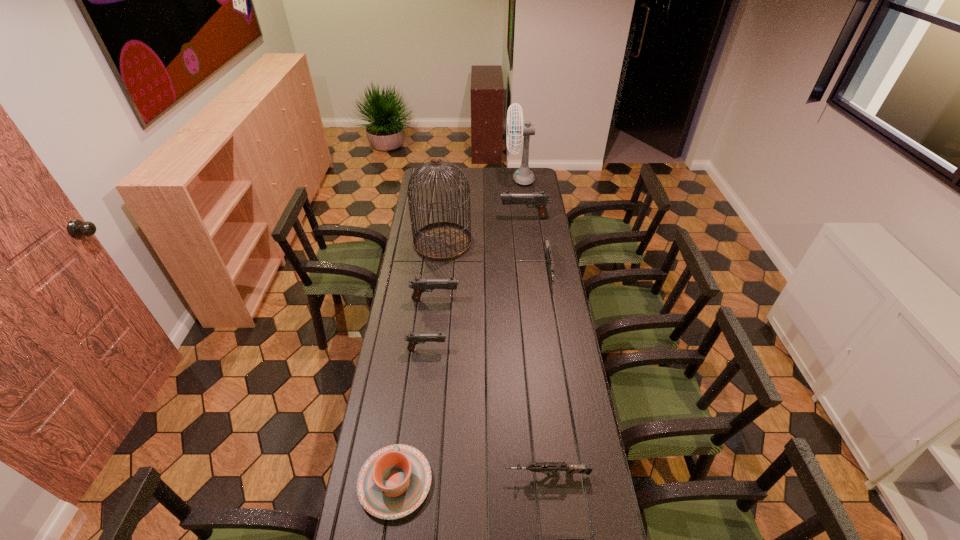
Locate an element on the screen. The width and height of the screenshot is (960, 540). the second farthest gun is located at coordinates (546, 240).

Locate an element on the screen. chinaware is located at coordinates (394, 481).

Image resolution: width=960 pixels, height=540 pixels. What are the coordinates of `the second farthest grey gun` in the screenshot? It's located at (553, 467).

In order to click on the fifth farthest gun in this screenshot , I will do `click(553, 467)`.

Find the location of a particular element. This screenshot has width=960, height=540. free spot located on the front-facing side of the farthest object is located at coordinates (491, 179).

Find the location of a particular element. free space located on the front-facing side of the farthest object is located at coordinates click(x=467, y=179).

Where is `blank area located 0.340m on the front-facing side of the farthest object`? The width and height of the screenshot is (960, 540). blank area located 0.340m on the front-facing side of the farthest object is located at coordinates (450, 179).

Find the location of `free space located 0.370m on the right of the birdcage`. free space located 0.370m on the right of the birdcage is located at coordinates (543, 242).

The width and height of the screenshot is (960, 540). In order to click on free space located 0.190m in the direction the farthest gray gun is aimed in this screenshot , I will do `click(466, 218)`.

Find the location of a particular element. This screenshot has width=960, height=540. free spot located 0.050m in the direction the farthest gray gun is aimed is located at coordinates (491, 218).